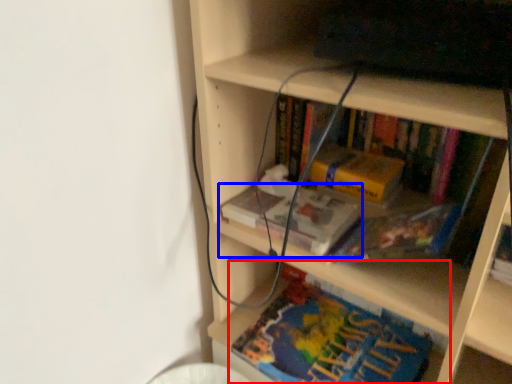
Question: Which object is closer to the camera taking this photo, book (highlighted by a red box) or book (highlighted by a blue box)?

Choices:
 (A) book
 (B) book

Answer: (A)